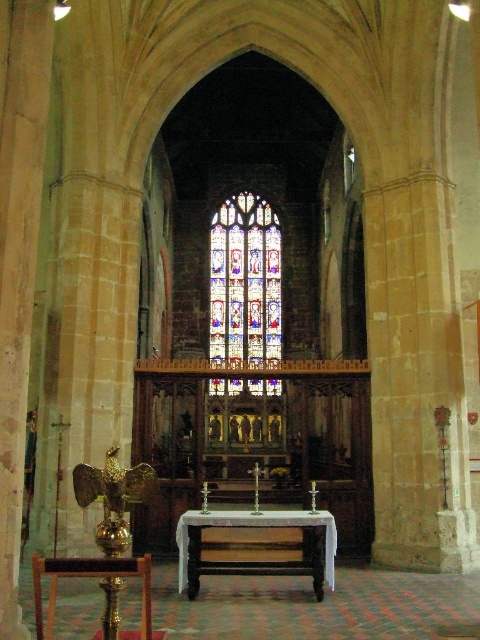
Question: Is stained glass window at center above white polished wood altar at center?

Choices:
 (A) no
 (B) yes

Answer: (B)

Question: Which of the following is the farthest from the observer?

Choices:
 (A) white polished wood altar at center
 (B) stained glass window at center

Answer: (B)

Question: Where is stained glass window at center located in relation to white polished wood altar at center in the image?

Choices:
 (A) left
 (B) right

Answer: (A)

Question: Is stained glass window at center bigger than white polished wood altar at center?

Choices:
 (A) yes
 (B) no

Answer: (A)

Question: Which point appears farthest from the camera in this image?

Choices:
 (A) (236, 280)
 (B) (325, 548)

Answer: (A)